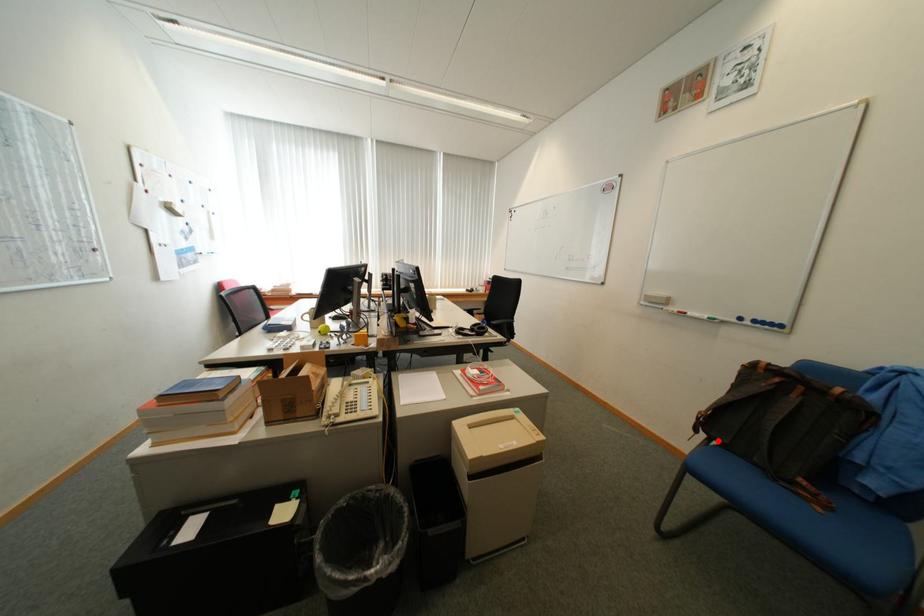
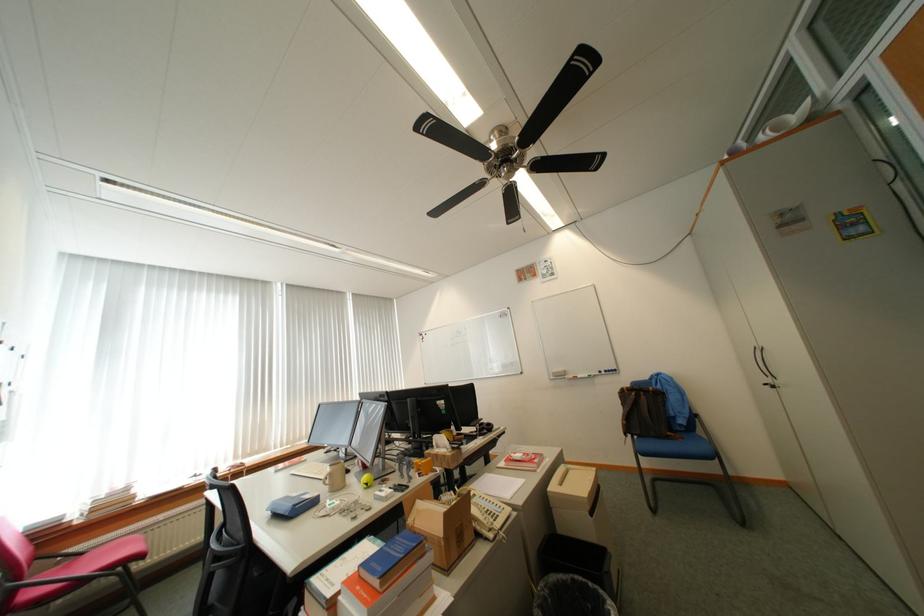
Question: I am providing you with two images of the same scene from different viewpoints. In image1, a red point is highlighted. Considering the same 3D point in image2, which of the following is correct?

Choices:
 (A) It is closer
 (B) It is farther

Answer: (B)